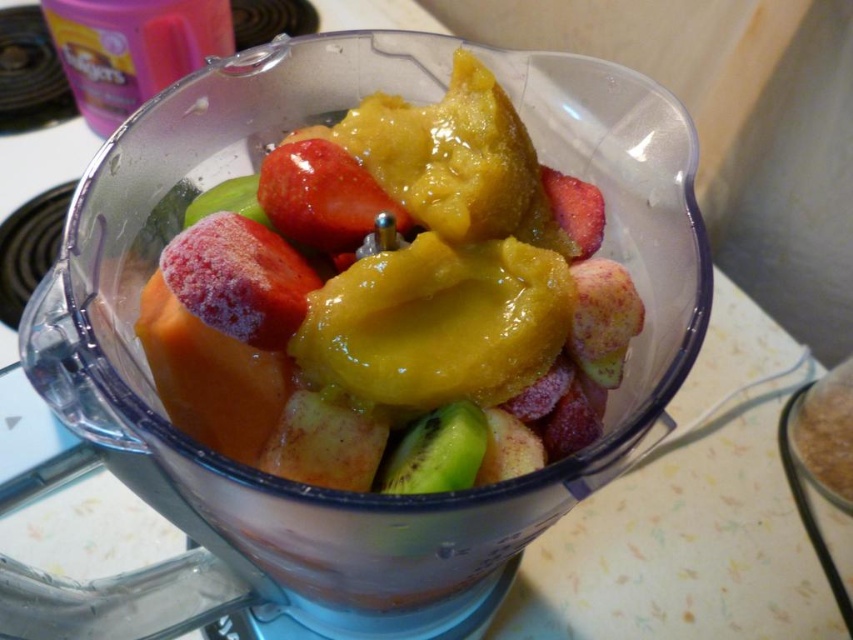
In the scene shown: You are a nutritionist analyzing the contents of the blender. Which fruit is larger in size between the shiny red strawberry at center and the green matte kiwi at center?

The shiny red strawberry at center is bigger than the green matte kiwi at center.

You are trying to locate the shiny red strawberry at center in the blender. According to the image, where is it positioned relative to the green matte kiwi at center?

The shiny red strawberry at center is positioned above the green matte kiwi at center in the blender.

You are looking into the blender and see the shiny red strawberry at center and the green matte kiwi at center. Which fruit is closer to your eyes?

Answer: The shiny red strawberry at center is closer to your eyes than the green matte kiwi at center.